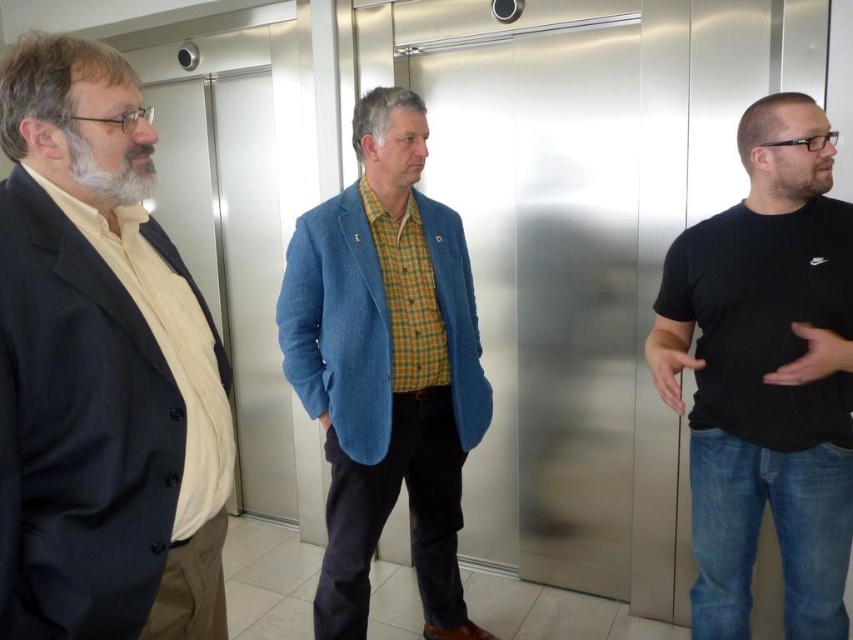
Question: Can you confirm if black cotton t-shirt at right is bigger than blue corduroy blazer at center?

Choices:
 (A) no
 (B) yes

Answer: (A)

Question: Which object is the farthest from the blue corduroy blazer at center?

Choices:
 (A) matte black suit at left
 (B) black cotton t-shirt at right

Answer: (A)

Question: Is matte black suit at left to the right of black cotton t-shirt at right from the viewer's perspective?

Choices:
 (A) no
 (B) yes

Answer: (A)

Question: Is black cotton t-shirt at right thinner than blue corduroy blazer at center?

Choices:
 (A) yes
 (B) no

Answer: (A)

Question: Among these objects, which one is nearest to the camera?

Choices:
 (A) black cotton t-shirt at right
 (B) blue corduroy blazer at center
 (C) matte black suit at left

Answer: (C)

Question: Which point is closer to the camera?

Choices:
 (A) (96, 557)
 (B) (814, 273)

Answer: (A)